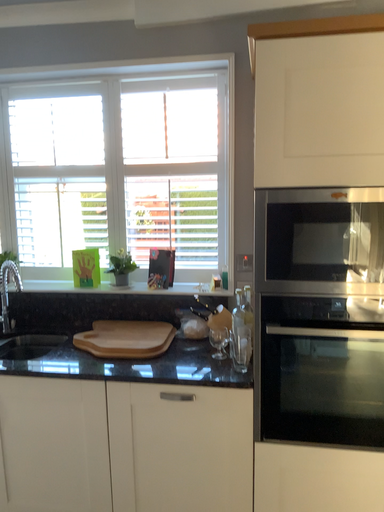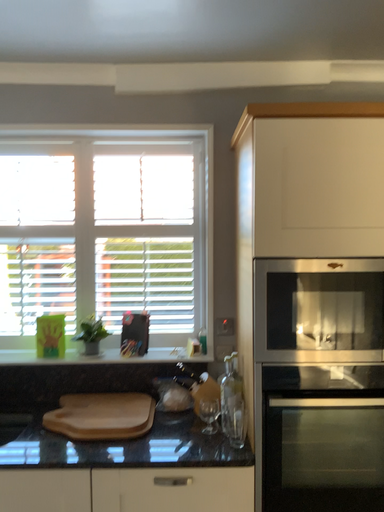
Question: Which way did the camera rotate in the video?

Choices:
 (A) rotated upward
 (B) rotated downward

Answer: (A)